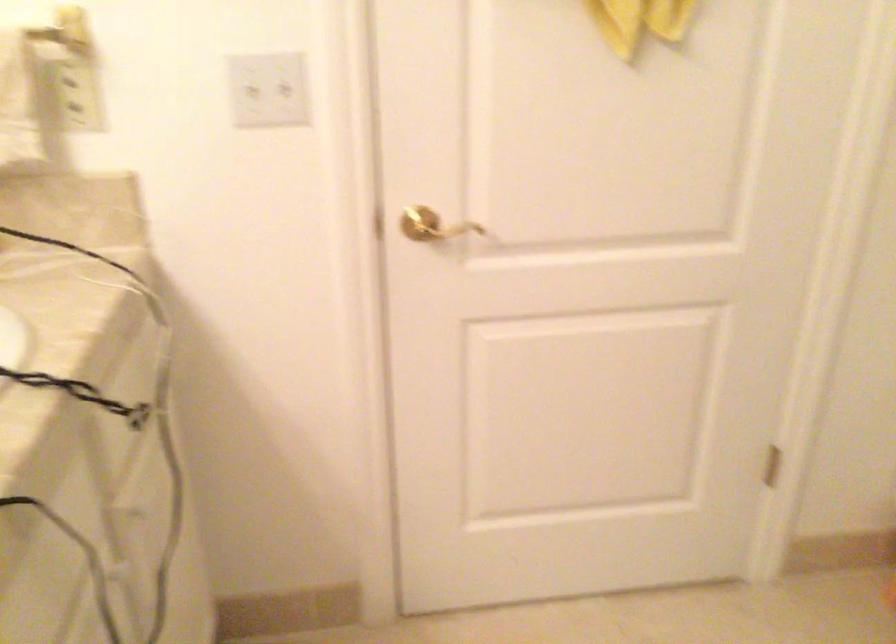
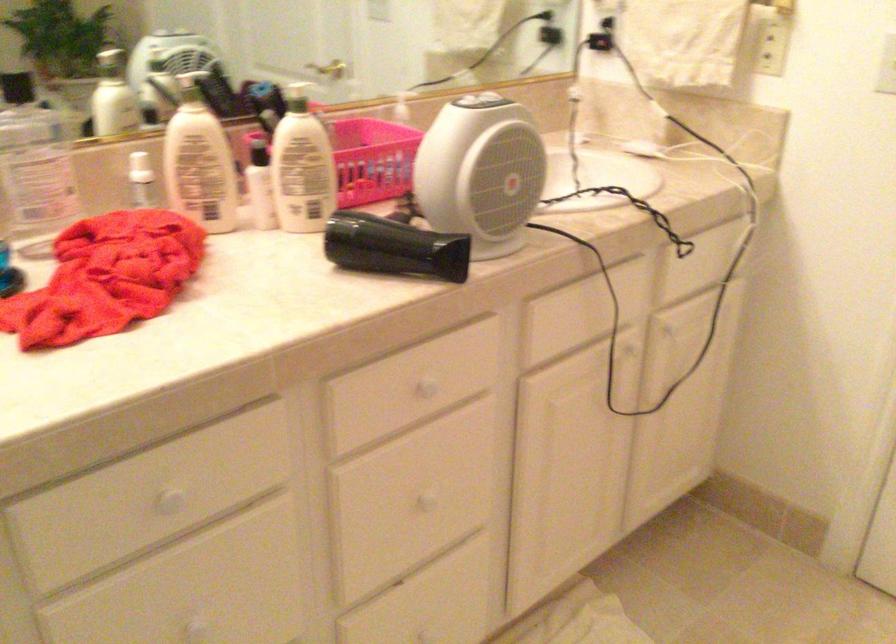
Where in the second image is the point corresponding to (x=158, y=498) from the first image?

(675, 335)